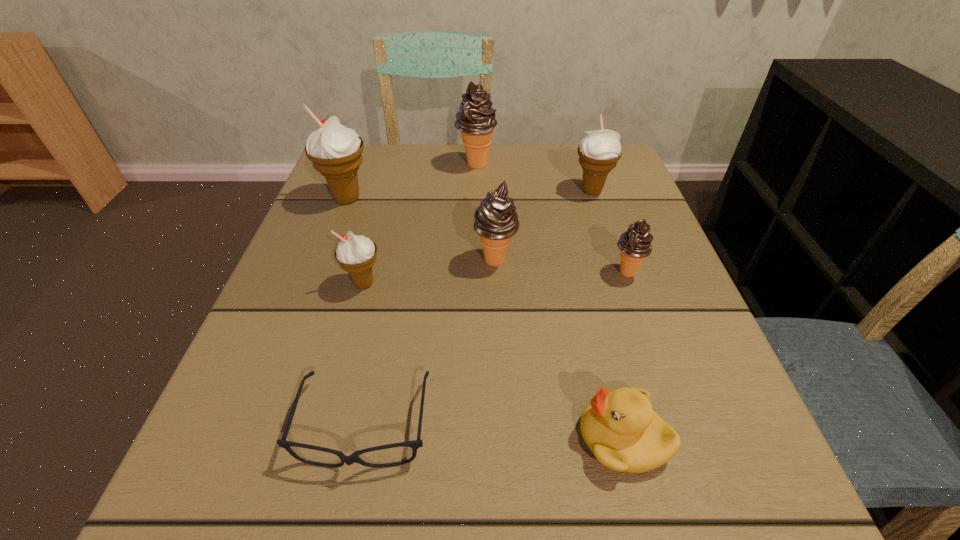
The image size is (960, 540). Identify the location of vacant space that's between the yellow duckling and the shortest object. (494, 431).

The width and height of the screenshot is (960, 540). Find the location of `unoccupied position between the biggest white icecream and the shortest object`. unoccupied position between the biggest white icecream and the shortest object is located at coordinates tap(356, 312).

Identify which object is located as the nearest to the second biggest white icecream. Please provide its 2D coordinates. Your answer should be formatted as a tuple, i.e. [(x, y)], where the tuple contains the x and y coordinates of a point satisfying the conditions above.

[(476, 121)]

Locate which object is the third closest to the shortest object. Please provide its 2D coordinates. Your answer should be formatted as a tuple, i.e. [(x, y)], where the tuple contains the x and y coordinates of a point satisfying the conditions above.

[(496, 221)]

I want to click on the fifth closest icecream relative to the smallest chocolate icecream, so click(336, 151).

This screenshot has height=540, width=960. Identify the location of icecream that can be found as the fourth closest to the smallest chocolate icecream. (356, 254).

The height and width of the screenshot is (540, 960). In order to click on chocolate icecream that is the third closest to the yellow duckling in this screenshot , I will do [x=476, y=121].

Find the location of `chocolate icecream that is the third closest one to the nearest white icecream`. chocolate icecream that is the third closest one to the nearest white icecream is located at coordinates (635, 244).

This screenshot has width=960, height=540. I want to click on white icecream that stands as the second closest to the spectacles, so click(336, 151).

Where is `white icecream that is the closest to the rightmost white icecream`? The image size is (960, 540). white icecream that is the closest to the rightmost white icecream is located at coordinates (356, 254).